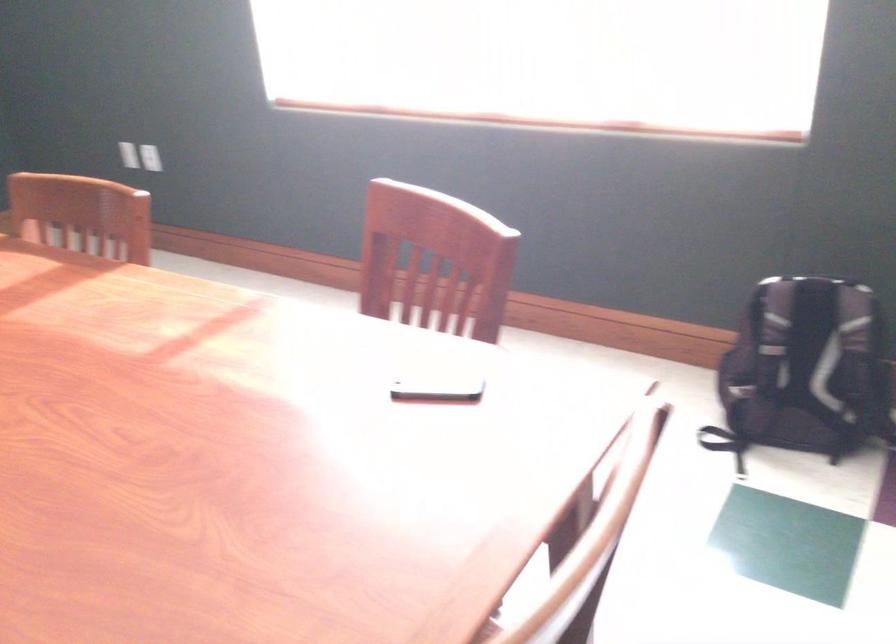
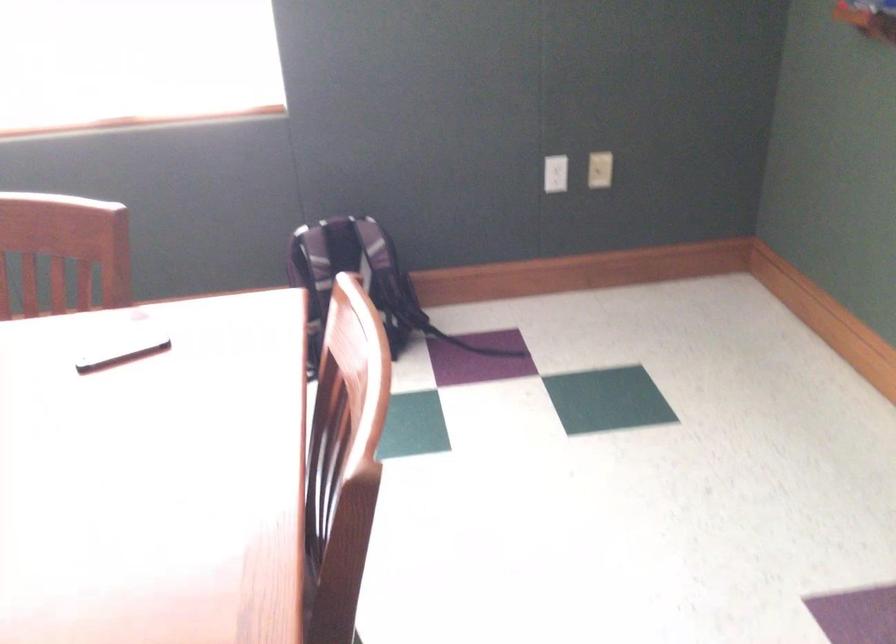
Question: The first image is from the beginning of the video and the second image is from the end. How did the camera likely rotate when shooting the video?

Choices:
 (A) Left
 (B) Right
 (C) Up
 (D) Down

Answer: (B)